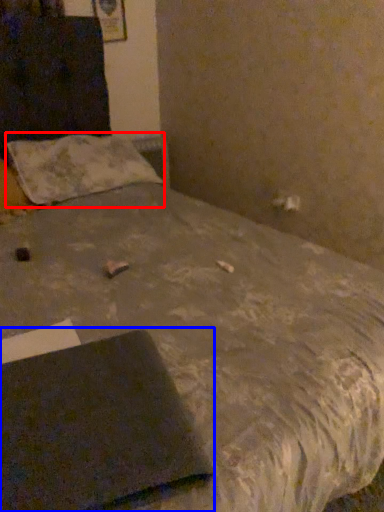
Question: Which object appears farthest to the camera in this image, pillow (highlighted by a red box) or notebook (highlighted by a blue box)?

Choices:
 (A) pillow
 (B) notebook

Answer: (A)